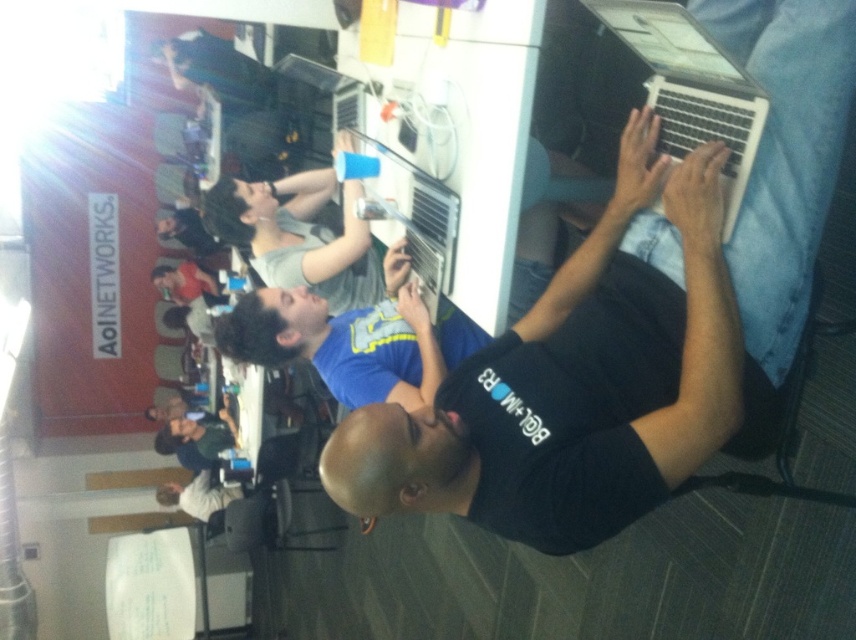
You are standing at the point labeled point (670, 20) and want to walk to the point labeled point (476, 429). Given the rotated image, will you have to walk towards the left or the right to reach your destination?

Since point (476, 429) is behind point (670, 20), you would need to walk towards the right to reach the destination from point (670, 20).

You are a delivery person who needs to place a new laptop between the black matte laptop at center and the silver metallic laptop at upper right. Based on their positions, where should you place the new laptop?

The black matte laptop at center is below the silver metallic laptop at upper right, so you should place the new laptop between them by positioning it above the black matte laptop at center and below the silver metallic laptop at upper right.